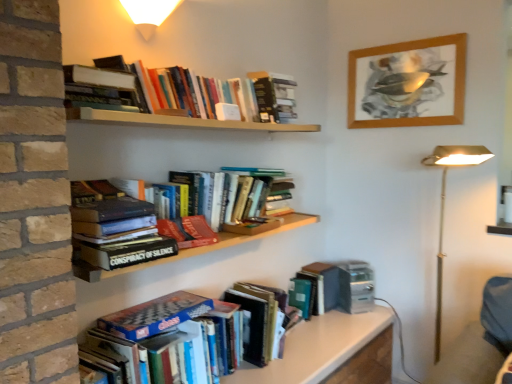
Question: Considering the relative positions of hardcover book at upper left, which is the fifth book from bottom to top, and hardcover book at upper center, which appears as the 7th book when ordered from the bottom, in the image provided, is hardcover book at upper left, which is the fifth book from bottom to top, in front of hardcover book at upper center, which appears as the 7th book when ordered from the bottom,?

Choices:
 (A) yes
 (B) no

Answer: (A)

Question: From the image's perspective, is hardcover book at upper left, the 3th book positioned from the top, beneath hardcover book at upper center, which is counted as the 1th book, starting from the top?

Choices:
 (A) yes
 (B) no

Answer: (A)

Question: Is hardcover book at upper left, which is the fifth book from bottom to top, oriented towards hardcover book at upper center, which is counted as the 1th book, starting from the top?

Choices:
 (A) yes
 (B) no

Answer: (B)

Question: Can you confirm if hardcover book at upper left, which is the fifth book from bottom to top, is wider than hardcover book at upper center, which is counted as the 1th book, starting from the top?

Choices:
 (A) no
 (B) yes

Answer: (B)

Question: From a real-world perspective, is hardcover book at upper left, the 3th book positioned from the top, located higher than hardcover book at upper center, which is counted as the 1th book, starting from the top?

Choices:
 (A) no
 (B) yes

Answer: (A)

Question: Considering the positions of metallic gold floor lamp at right and blue glossy chess set at lower center, marked as the 1th book in a bottom-to-top arrangement, in the image, is metallic gold floor lamp at right bigger or smaller than blue glossy chess set at lower center, marked as the 1th book in a bottom-to-top arrangement,?

Choices:
 (A) big
 (B) small

Answer: (A)

Question: Is metallic gold floor lamp at right situated inside blue glossy chess set at lower center, marked as the 1th book in a bottom-to-top arrangement, or outside?

Choices:
 (A) inside
 (B) outside

Answer: (B)

Question: Considering their positions, is metallic gold floor lamp at right located in front of or behind blue glossy chess set at lower center, marked as the 1th book in a bottom-to-top arrangement?

Choices:
 (A) behind
 (B) front

Answer: (A)

Question: From a real-world perspective, is metallic gold floor lamp at right physically located above or below blue glossy chess set at lower center, which is the 7th book from top to bottom?

Choices:
 (A) above
 (B) below

Answer: (A)

Question: In terms of height, does hardcover book at center, which is counted as the 3th book, starting from the bottom, look taller or shorter compared to metallic gold floor lamp at right?

Choices:
 (A) short
 (B) tall

Answer: (A)

Question: From the image's perspective, is hardcover book at center, the fifth book positioned from the top, located above or below metallic gold floor lamp at right?

Choices:
 (A) above
 (B) below

Answer: (A)

Question: Is point (161, 225) positioned closer to the camera than point (437, 317)?

Choices:
 (A) farther
 (B) closer

Answer: (B)

Question: Relative to metallic gold floor lamp at right, is hardcover book at center, the fifth book positioned from the top, in front or behind?

Choices:
 (A) front
 (B) behind

Answer: (A)

Question: Looking at the image, does white glossy table at lower center seem bigger or smaller compared to hardcover book at upper center, which is counted as the 1th book, starting from the top?

Choices:
 (A) small
 (B) big

Answer: (B)

Question: In the image, is white glossy table at lower center positioned in front of or behind hardcover book at upper center, which appears as the 7th book when ordered from the bottom?

Choices:
 (A) front
 (B) behind

Answer: (A)